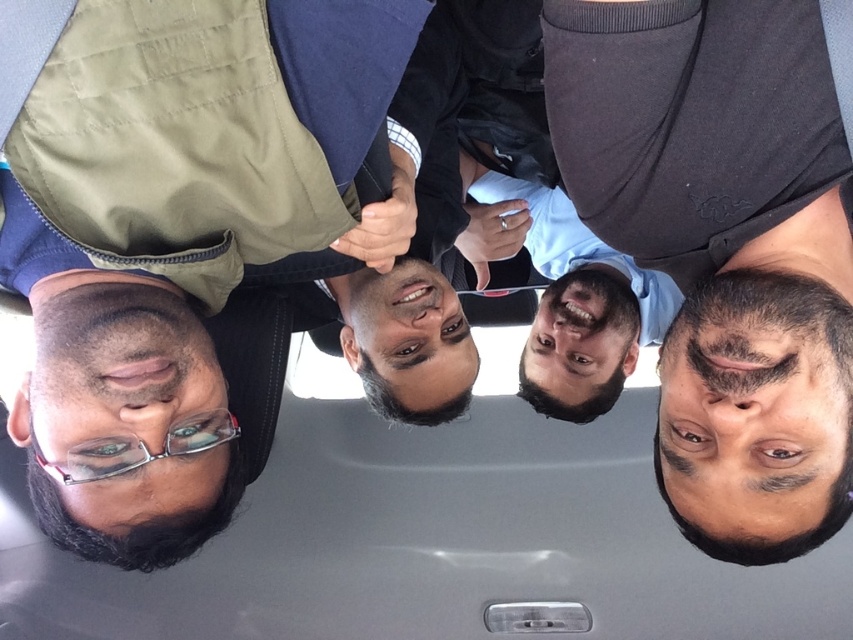
Who is more forward, (817,460) or (521,230)?

Point (817,460) is in front.

Is point (648, 259) more distant than point (515, 204)?

No, it is in front of (515, 204).

The width and height of the screenshot is (853, 640). What do you see at coordinates (724, 246) in the screenshot? I see `dark gray matte shirt at upper right` at bounding box center [724, 246].

Identify the location of dark gray matte shirt at upper right. (724, 246).

Where is `dark gray matte shirt at upper right`? The height and width of the screenshot is (640, 853). dark gray matte shirt at upper right is located at coordinates (724, 246).

Is dark gray matte shirt at upper right above matte black hand at center?

No.

What do you see at coordinates (724, 246) in the screenshot?
I see `dark gray matte shirt at upper right` at bounding box center [724, 246].

The height and width of the screenshot is (640, 853). I want to click on dark gray matte shirt at upper right, so click(x=724, y=246).

Is matte black hand at center positioned in front of matte black phone at center?

Yes, matte black hand at center is closer to the viewer.

Who is positioned more to the right, matte black hand at center or matte black phone at center?

matte black phone at center is more to the right.

At what (x,y) coordinates should I click in order to perform the action: click on matte black hand at center. Please return your answer as a coordinate pair (x, y). Looking at the image, I should click on (381, 227).

This screenshot has height=640, width=853. In order to click on matte black hand at center in this screenshot , I will do `click(381, 227)`.